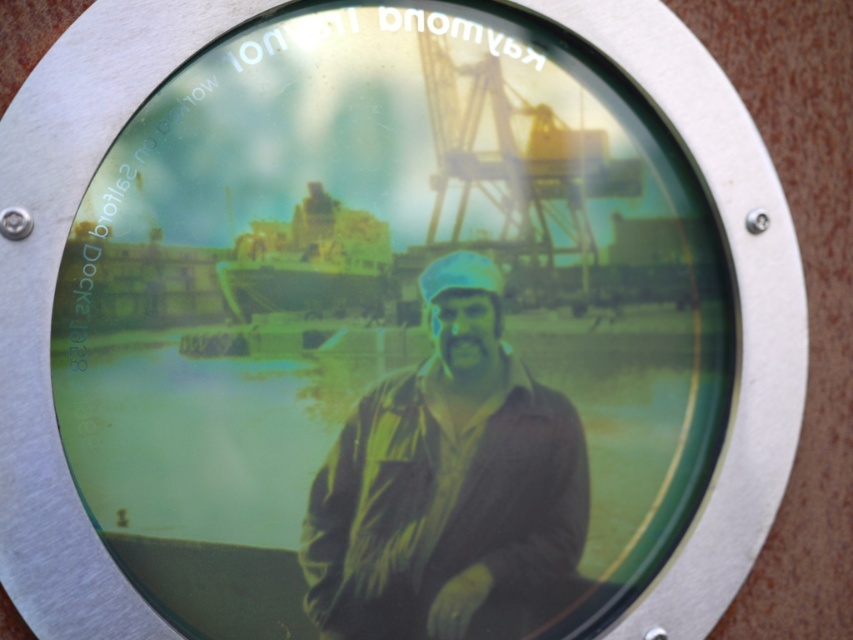
Question: Among these objects, which one is farthest from the camera?

Choices:
 (A) matte black jacket at center
 (B) yellow-green plastic boat at center

Answer: (A)

Question: Is matte black jacket at center to the left of yellow-green plastic boat at center from the viewer's perspective?

Choices:
 (A) yes
 (B) no

Answer: (B)

Question: Does matte black jacket at center appear on the right side of yellow-green plastic boat at center?

Choices:
 (A) yes
 (B) no

Answer: (A)

Question: Does matte black jacket at center have a lesser width compared to yellow-green plastic boat at center?

Choices:
 (A) no
 (B) yes

Answer: (A)